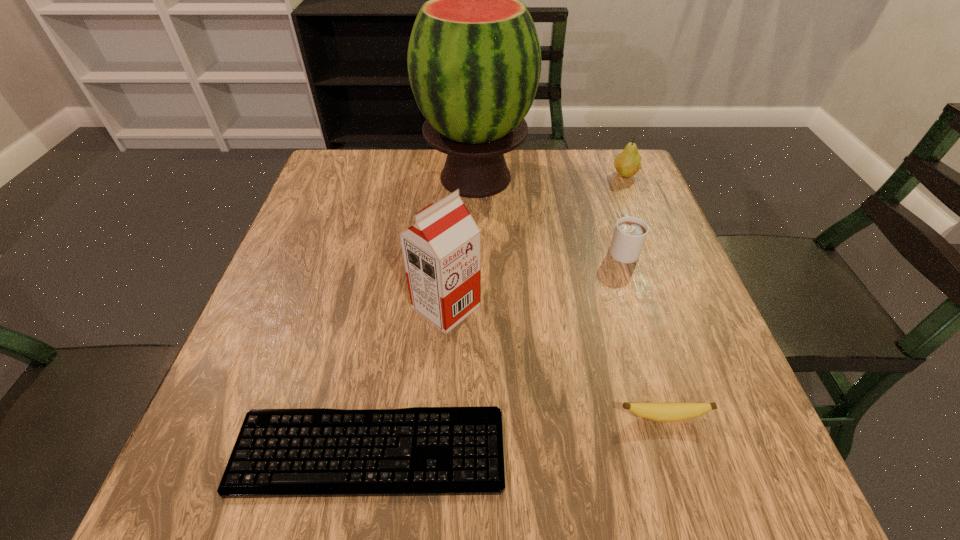
Identify the location of pear at the right edge. This screenshot has width=960, height=540. (628, 163).

Identify the location of cappuccino located at the right edge. (630, 233).

Find the location of `banana located in the right edge section of the desktop`. banana located in the right edge section of the desktop is located at coordinates (661, 412).

At what (x,y) coordinates should I click in order to perform the action: click on object positioned at the near left corner. Please return your answer as a coordinate pair (x, y). Looking at the image, I should click on (422, 451).

In order to click on object located at the far right corner in this screenshot , I will do `click(628, 163)`.

You are a GUI agent. You are given a task and a screenshot of the screen. Output one action in this format:
    pyautogui.click(x=<x>, y=<y>)
    Task: Click on the vacant space at the far edge of the desktop
    
    Given the screenshot: What is the action you would take?
    pyautogui.click(x=394, y=198)

Locate an element on the screen. free space at the near edge is located at coordinates (413, 501).

Locate an element on the screen. The image size is (960, 540). free region at the left edge of the desktop is located at coordinates (336, 213).

You are a GUI agent. You are given a task and a screenshot of the screen. Output one action in this format:
    pyautogui.click(x=<x>, y=<y>)
    Task: Click on the vacant space at the right edge of the desktop
    
    Given the screenshot: What is the action you would take?
    pyautogui.click(x=639, y=269)

I want to click on vacant region at the far left corner of the desktop, so click(325, 159).